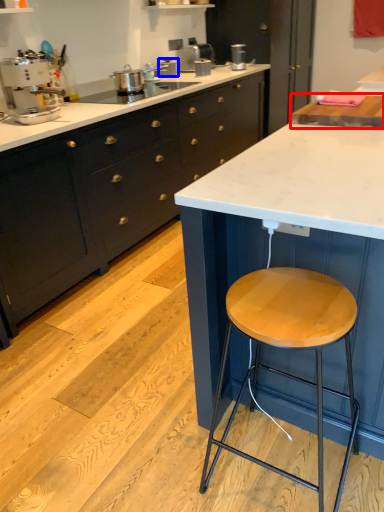
Question: Which of the following is the farthest to the observer, countertop (highlighted by a red box) or appliance (highlighted by a blue box)?

Choices:
 (A) countertop
 (B) appliance

Answer: (B)